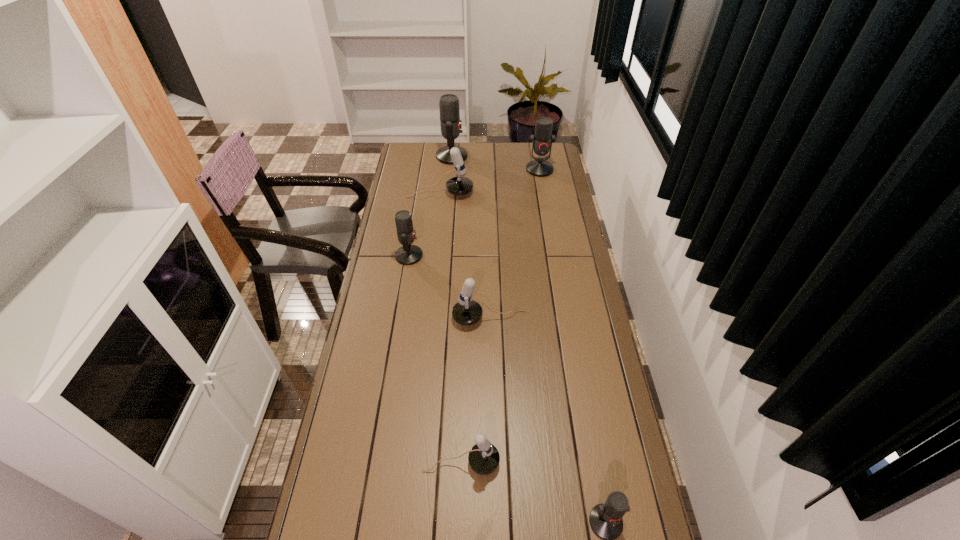
Identify the location of the second red microphone from left to right. (450, 122).

The width and height of the screenshot is (960, 540). In order to click on the tallest object in this screenshot , I will do `click(450, 122)`.

Where is `the third smallest red microphone`? The height and width of the screenshot is (540, 960). the third smallest red microphone is located at coordinates (542, 140).

Where is `the fifth nearest microphone`? Image resolution: width=960 pixels, height=540 pixels. the fifth nearest microphone is located at coordinates (458, 185).

Where is `the third farthest object`? Image resolution: width=960 pixels, height=540 pixels. the third farthest object is located at coordinates (458, 185).

I want to click on the leftmost red microphone, so click(408, 254).

Identify the location of the fourth farthest object. This screenshot has height=540, width=960. (408, 254).

Locate an element on the screen. This screenshot has height=540, width=960. the second smallest white microphone is located at coordinates (466, 311).

Identify the location of the second nearest white microphone. This screenshot has width=960, height=540. (466, 311).

I want to click on the nearest white microphone, so click(x=483, y=458).